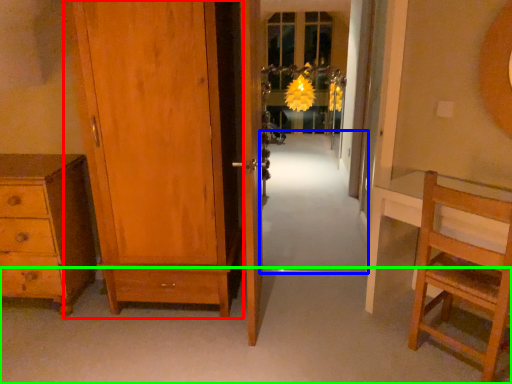
Question: Which object is the farthest from door (highlighted by a red box)? Choose among these: path (highlighted by a blue box) or path (highlighted by a green box).

Choices:
 (A) path
 (B) path

Answer: (A)